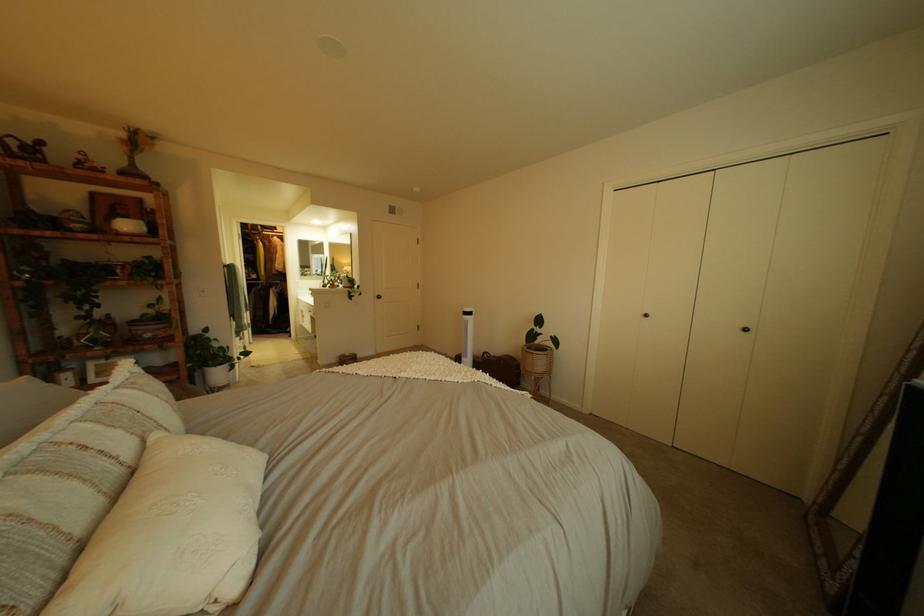
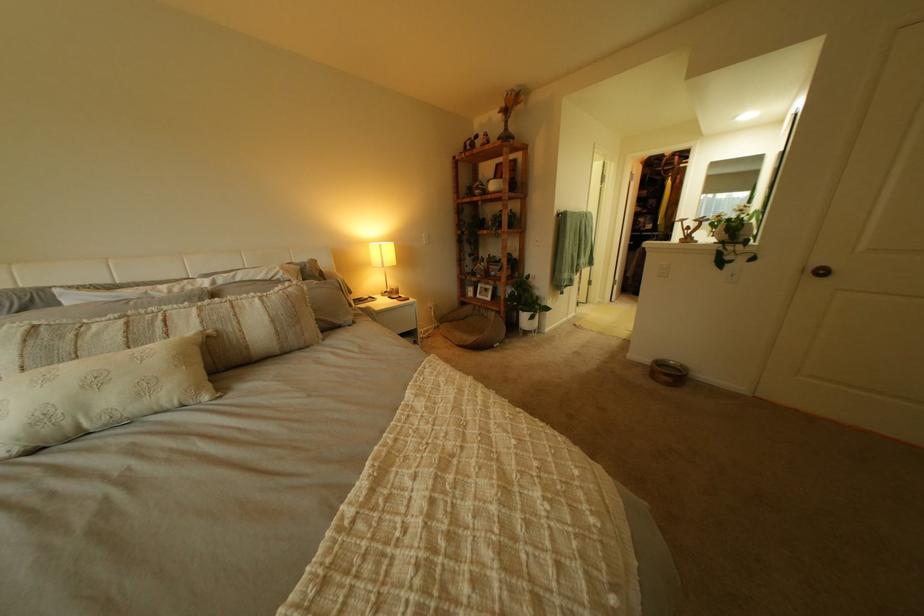
Find the pixel in the second image that matches [348,362] in the first image.

(663, 362)